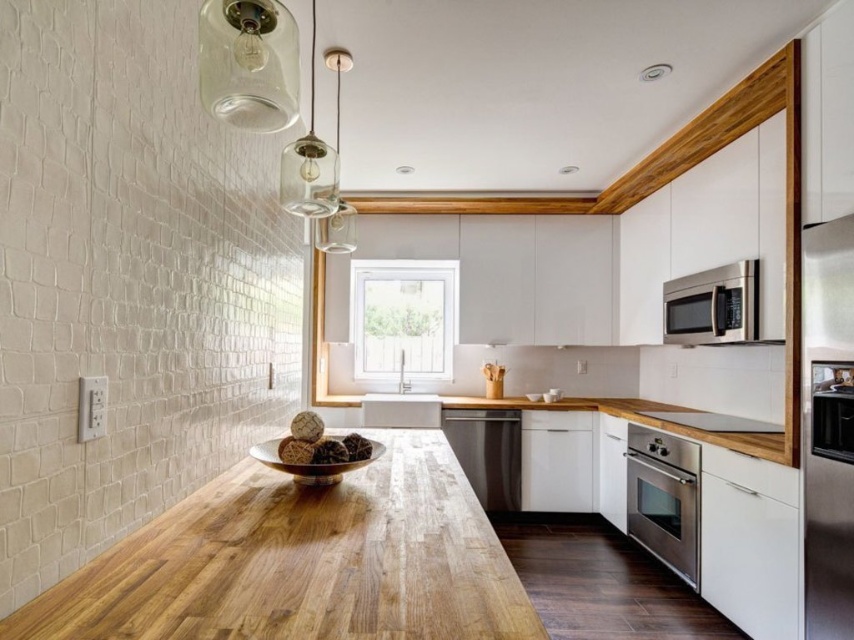
Question: Considering the real-world distances, which object is closest to the satin stainless steel microwave at upper right?

Choices:
 (A) stainless steel oven at lower right
 (B) wooden countertop at center
 (C) satin stainless steel dishwasher at center

Answer: (B)

Question: Among these points, which one is farthest from the camera?

Choices:
 (A) (463, 454)
 (B) (843, 582)

Answer: (A)

Question: Is satin stainless steel microwave at upper right smaller than wooden countertop at center?

Choices:
 (A) no
 (B) yes

Answer: (B)

Question: Does satin stainless steel microwave at upper right have a larger size compared to satin stainless steel dishwasher at center?

Choices:
 (A) yes
 (B) no

Answer: (B)

Question: Does satin stainless steel microwave at upper right appear on the right side of satin silver microwave at upper right?

Choices:
 (A) no
 (B) yes

Answer: (A)

Question: Among these points, which one is farthest from the camera?

Choices:
 (A) (644, 500)
 (B) (461, 433)

Answer: (B)